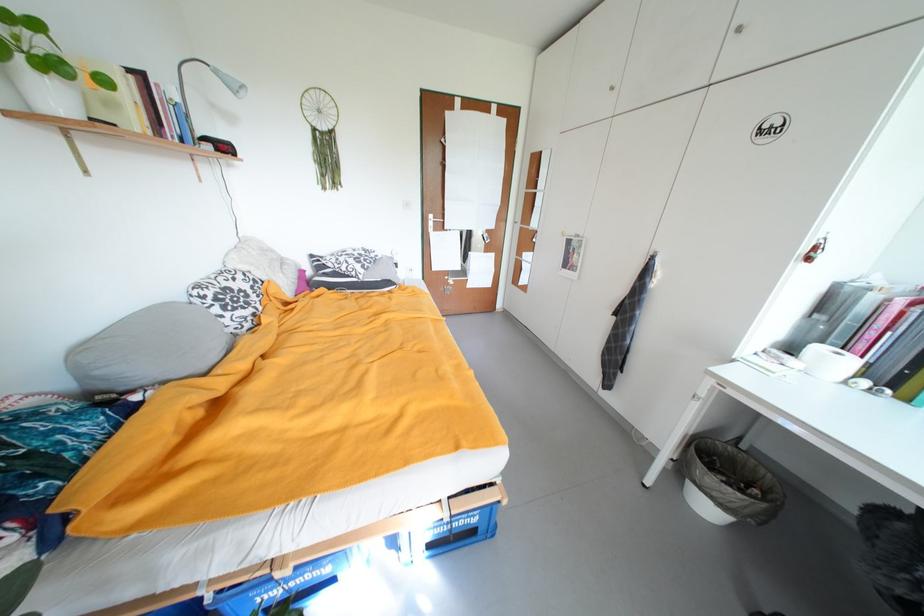
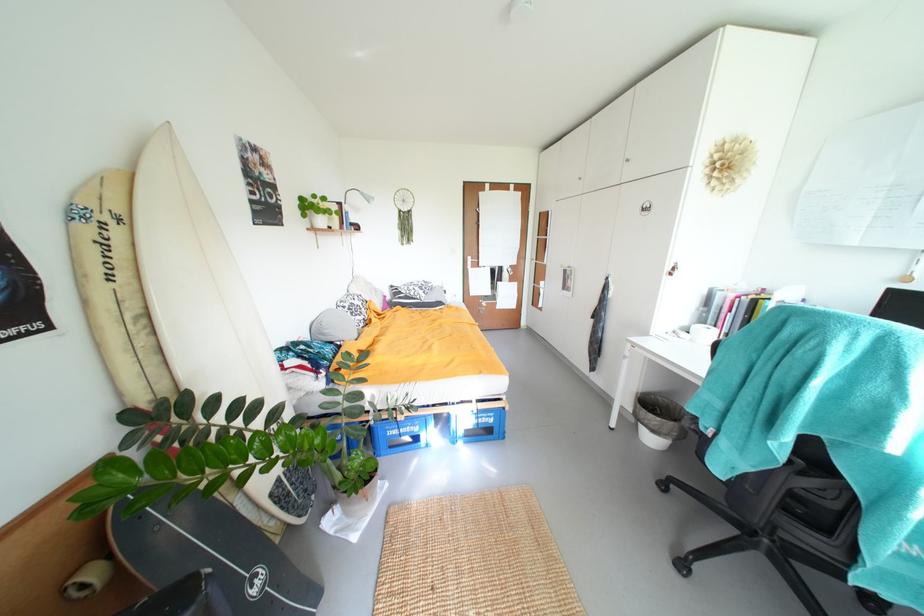
Question: The camera is either moving clockwise (left) or counter-clockwise (right) around the object. The first image is from the beginning of the video and the second image is from the end. Is the camera moving left or right when shooting the video?

Choices:
 (A) Left
 (B) Right

Answer: (B)